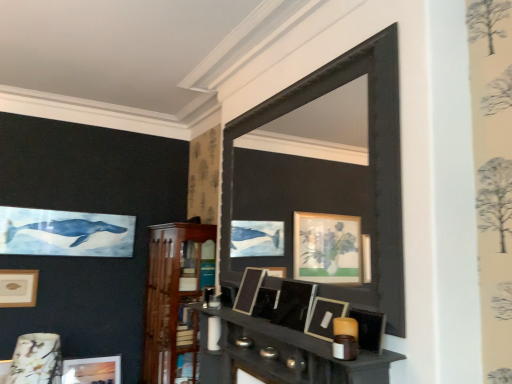
Question: Is matte black picture frame at center, the 1th picture frame from the top, bigger or smaller than matte gold picture frame at upper left, which ranks as the second picture frame in bottom-to-top order?

Choices:
 (A) small
 (B) big

Answer: (A)

Question: From the image's perspective, is matte black picture frame at center, the 1th picture frame from the top, above or below matte gold picture frame at upper left, arranged as the 5th picture frame when viewed from the right?

Choices:
 (A) below
 (B) above

Answer: (B)

Question: Which object is the closest to the matte black shelf at center, placed as the second shelf when sorted from back to front?

Choices:
 (A) porcelain floral-patterned lampshade at lower left
 (B) matte black picture frame at center, which is counted as the 5th picture frame, starting from the bottom
 (C) matte black picture frame at center, arranged as the fourth picture frame when viewed from the left
 (D) matte gold picture frame at upper left, which ranks as the second picture frame in bottom-to-top order
 (E) matte wooden picture frame at lower left, the second picture frame viewed from the left

Answer: (B)

Question: Estimate the real-world distances between objects in this image. Which object is farther from the matte wooden picture frame at lower left, which appears as the 1th picture frame when viewed from the back?

Choices:
 (A) matte black picture frame at center, the 1th picture frame from the top
 (B) porcelain floral-patterned lampshade at lower left
 (C) wooden shelf at center, the second shelf in the right-to-left sequence
 (D) matte gold picture frame at upper left, placed as the second picture frame when sorted from back to front
 (E) black matte mirror at center

Answer: (A)